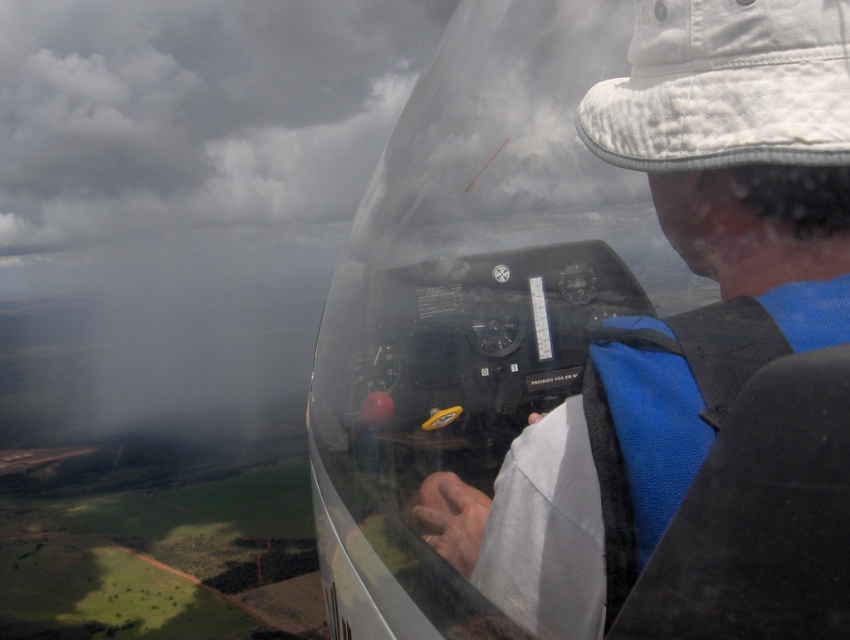
You are a flight attendant who needs to store a rectangular box that is 1 meter wide in the cockpit. Based on the image, can you fit the box horizontally in the transparent plastic cockpit at center without overlapping the cloudy gray sky at upper left?

The transparent plastic cockpit at center is narrower than the cloudy gray sky at upper left, but since the box is 1 meter wide, we need to know the cockpit width. However, the description only states the cockpit is less wide than the sky area. Without exact dimensions, it is impossible to determine if the cockpit can fit the 1 meter wide box. Please check the cockpit dimensions again.

You are a drone operator planning to fly a drone through the space between the transparent plastic cockpit at center and the cloudy gray sky at upper left. The drone has a maximum flight distance of 400 feet. Based on the scene, will the drone be able to safely navigate this path?

The transparent plastic cockpit at center and cloudy gray sky at upper left are 386.11 feet apart. Since the drone has a maximum flight distance of 400 feet, it can safely navigate the path between them as the distance is within its range.